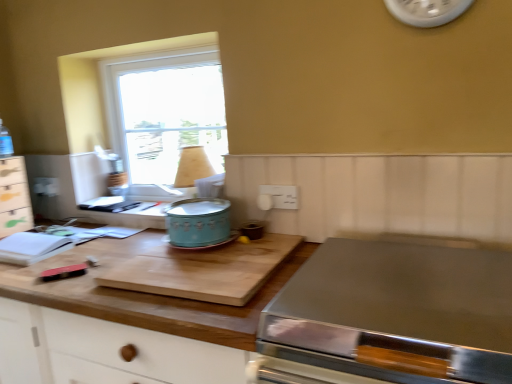
Where is `free spot above wooden cutting board at center (from a real-world perspective)`? This screenshot has width=512, height=384. free spot above wooden cutting board at center (from a real-world perspective) is located at coordinates (118, 254).